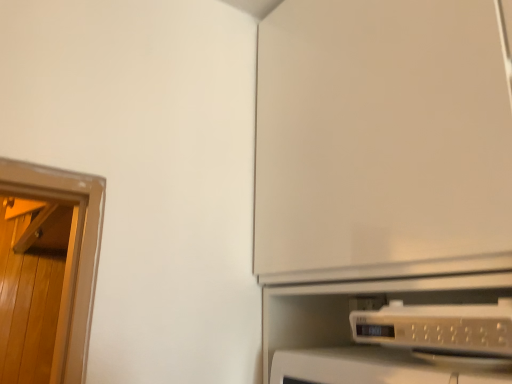
Question: Should I look upward or downward to see white plastic microwave at lower right?

Choices:
 (A) down
 (B) up

Answer: (A)